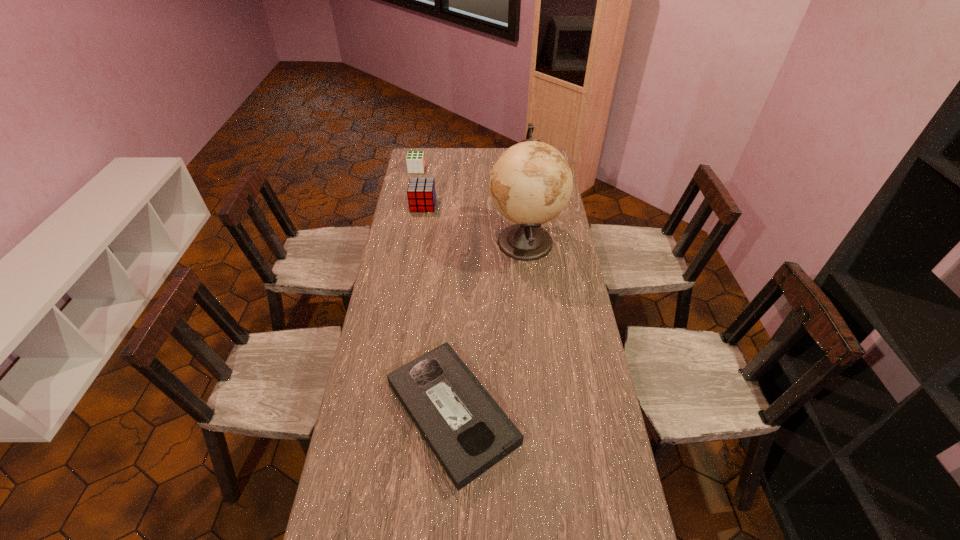
The height and width of the screenshot is (540, 960). Identify the location of vacant space located on the front-facing side of the second nearest object. (465, 241).

This screenshot has width=960, height=540. I want to click on free location located on the front of the nearer cube, so click(x=420, y=220).

Where is `vacant space located on the red face of the farthest object`? vacant space located on the red face of the farthest object is located at coordinates (496, 169).

At what (x,y) coordinates should I click in order to perform the action: click on vacant space positioned 0.070m on the right of the nearest object. Please return your answer as a coordinate pair (x, y). The height and width of the screenshot is (540, 960). Looking at the image, I should click on (543, 413).

Identify the location of object that is at the far edge. This screenshot has height=540, width=960. (415, 160).

The height and width of the screenshot is (540, 960). Identify the location of videotape present at the left edge. (468, 432).

Locate an element on the screen. This screenshot has height=540, width=960. object present at the right edge is located at coordinates (531, 183).

You are a GUI agent. You are given a task and a screenshot of the screen. Output one action in this format:
    pyautogui.click(x=<x>, y=<y>)
    Task: Click on the object positioned at the far left corner
    
    Given the screenshot: What is the action you would take?
    pyautogui.click(x=415, y=160)

Locate an element on the screen. Image resolution: width=960 pixels, height=540 pixels. vacant space at the far edge of the desktop is located at coordinates (444, 170).

In the image, there is a desktop. In order to click on vacant area at the left edge in this screenshot , I will do [368, 404].